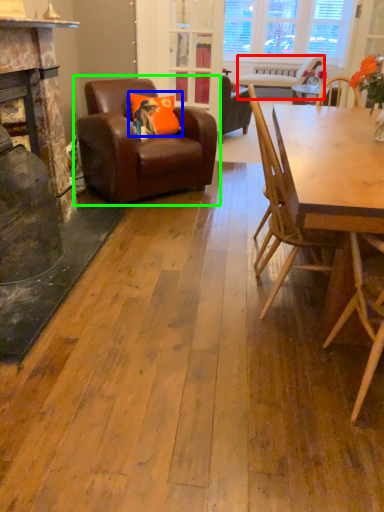
Question: Which object is the farthest from chair (highlighted by a red box)? Choose among these: pillow (highlighted by a blue box) or chair (highlighted by a green box).

Choices:
 (A) pillow
 (B) chair

Answer: (B)